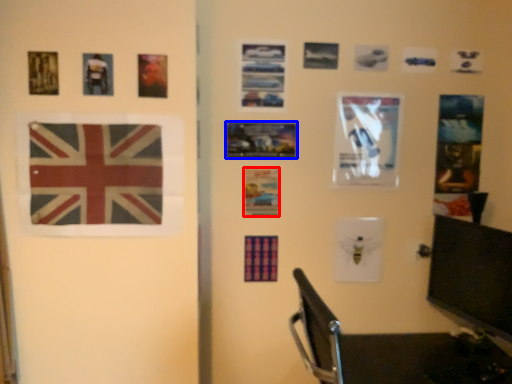
Question: Which point is closer to the camera, postcard (highlighted by a red box) or picture frame (highlighted by a blue box)?

Choices:
 (A) postcard
 (B) picture frame

Answer: (B)